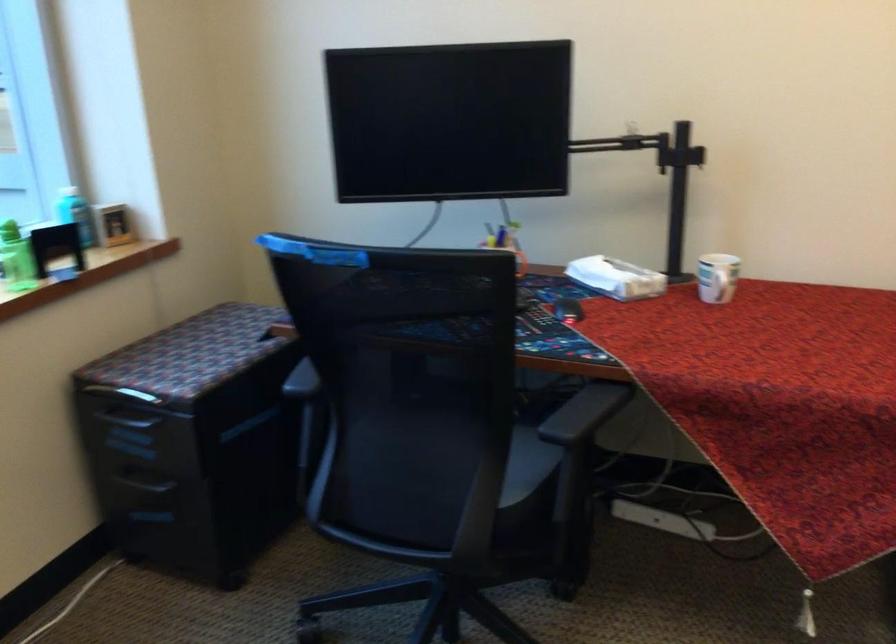
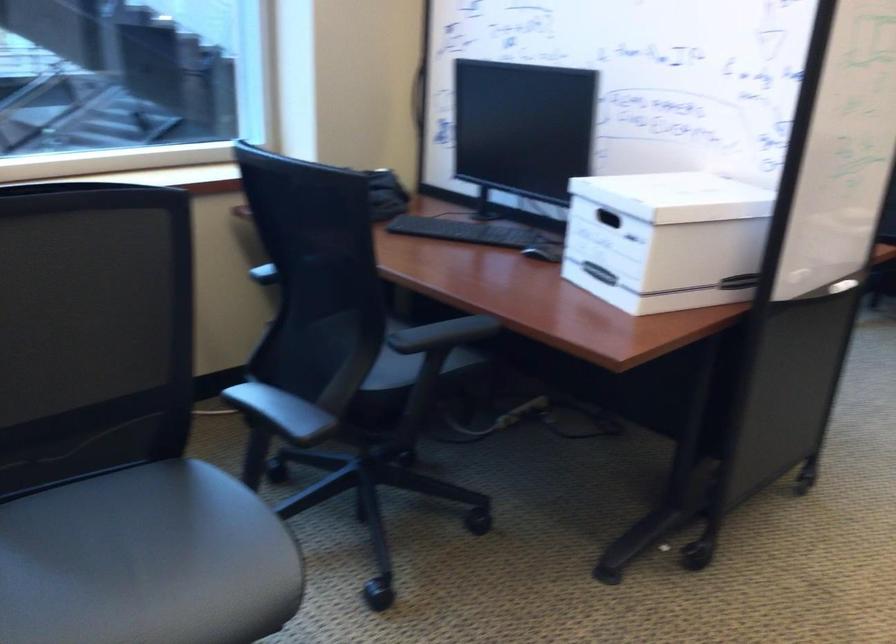
Question: I am providing you with two images of the same scene from different viewpoints. Please identify which objects are invisible in image2.

Choices:
 (A) small yellow ball
 (B) light blue bottle
 (C) black chair sitting surface
 (D) black chair armrest

Answer: (B)